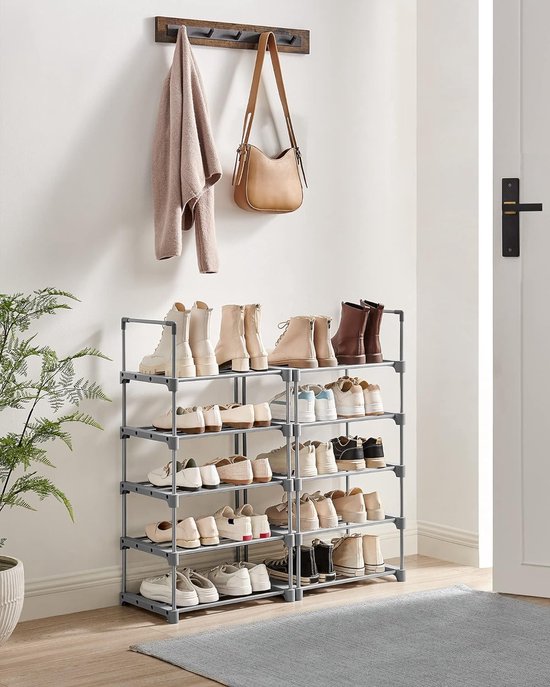
The width and height of the screenshot is (550, 687). In order to click on shoes on third shelf in this screenshot , I will do `click(196, 484)`, `click(212, 484)`, `click(238, 475)`, `click(261, 473)`, `click(305, 460)`, `click(324, 459)`, `click(354, 455)`, `click(370, 453)`.